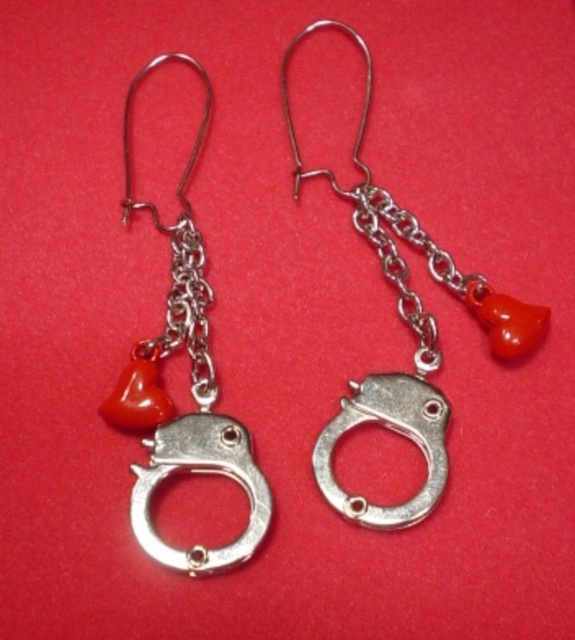
Describe the element at coordinates (409, 326) in the screenshot. I see `silver metallic handcuff at center` at that location.

Does point (396, 412) come closer to viewer compared to point (155, 355)?

Yes, it is.

The image size is (575, 640). Find the location of `silver metallic handcuff at center`. silver metallic handcuff at center is located at coordinates (409, 326).